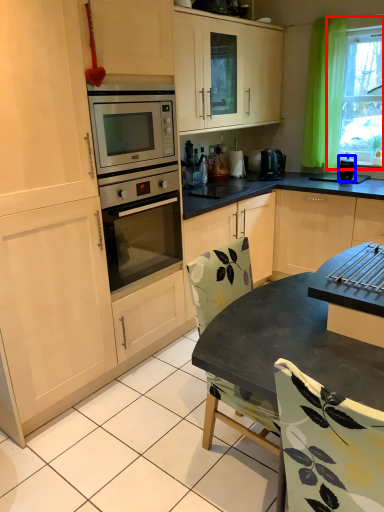
Question: Which object appears closest to the camera in this image, window (highlighted by a red box) or appliance (highlighted by a blue box)?

Choices:
 (A) window
 (B) appliance

Answer: (A)